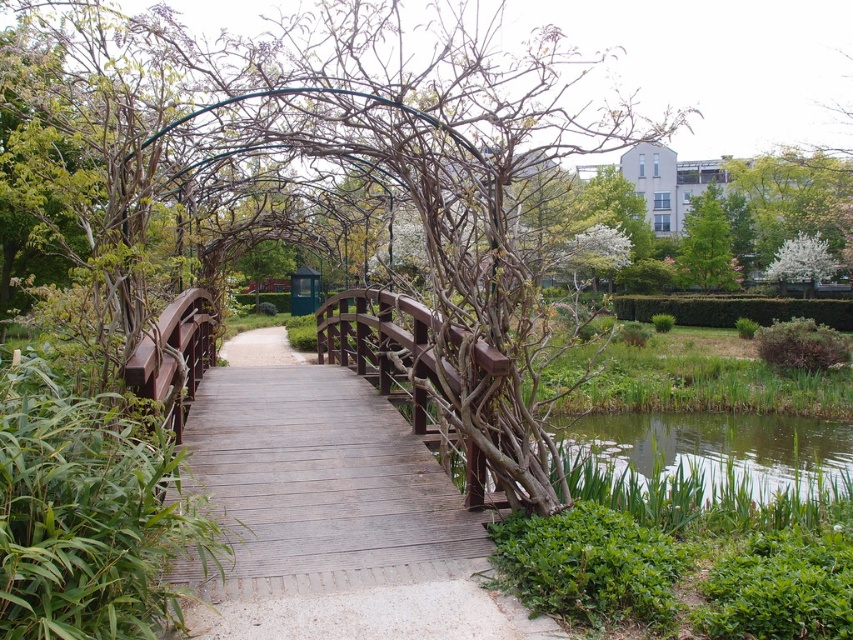
You are a gardener planning to place a new decorative fountain in the garden. The fountain requires a base that is smaller than the brown wood bridge at center. Can the green grassy water at lower right accommodate the fountain?

The brown wood bridge at center is larger in size than the green grassy water at lower right. Since the fountain requires a base smaller than the bridge, the green grassy water at lower right, being smaller, can accommodate the fountain.

You are a gardener who wants to plant a new flower bed between the green grassy water at lower right and the green leafy tree at upper right. Which object should you consider for the flower bed to ensure it is visible from above? Explain your choice based on their heights.

The green grassy water at lower right is shorter than the green leafy tree at upper right. To ensure visibility from above, the flower bed should be placed near the green grassy water at lower right since it is shorter and won

You are planning to build a small garden shed and need to know the height of the brown wood bridge at center and the green leafy tree at upper right. Can you tell me which one is taller?

The brown wood bridge at center is taller than the green leafy tree at upper right according to the description.